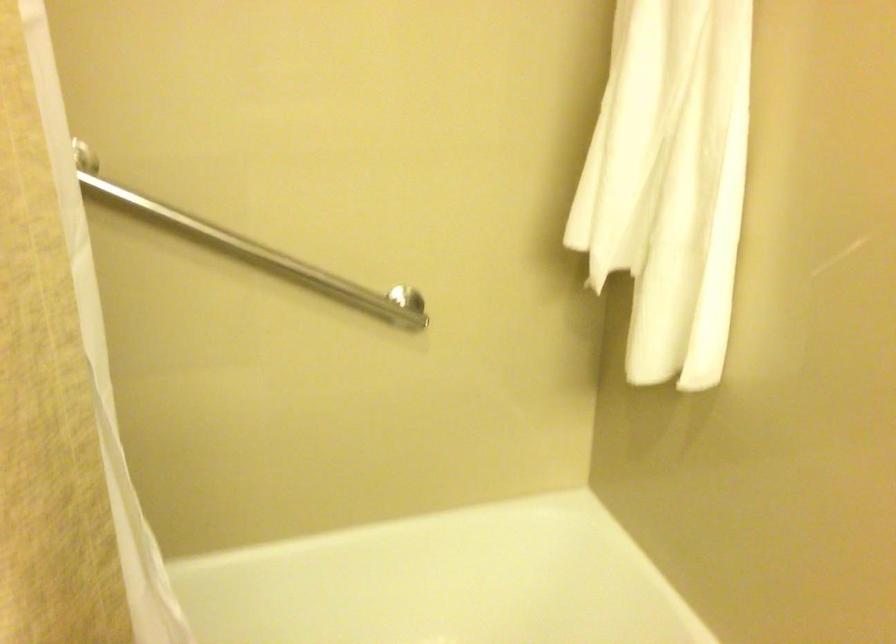
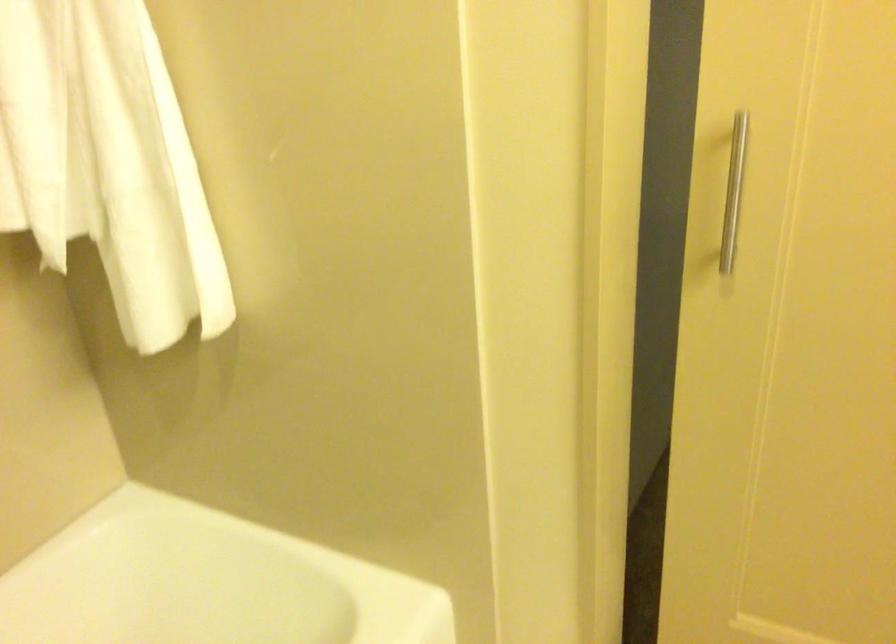
Question: Based on the continuous images, in which direction is the camera rotating? Reply with the corresponding letter.

Choices:
 (A) Left
 (B) Right
 (C) Up
 (D) Down

Answer: (B)